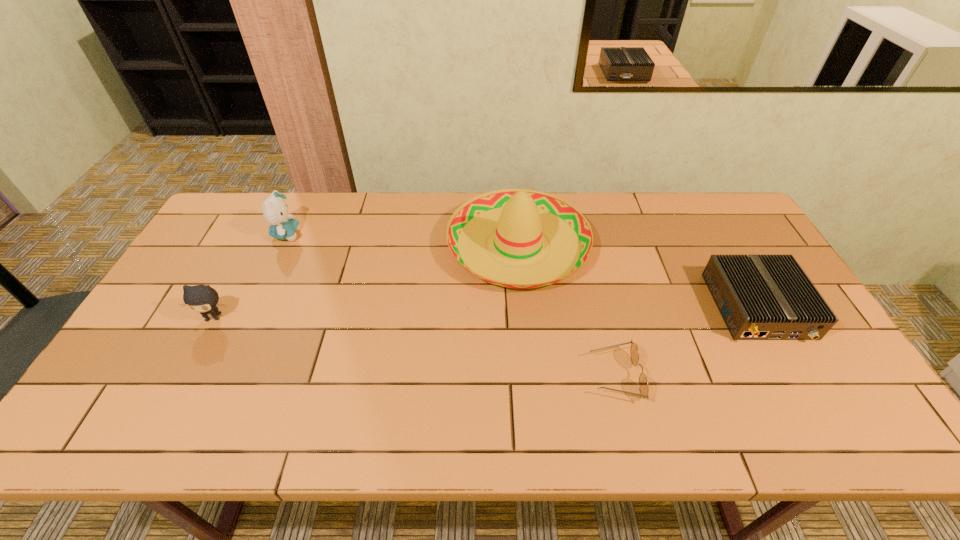
I want to click on sombrero, so click(520, 216).

Where is `the farther kitten`? the farther kitten is located at coordinates (275, 210).

Identify the location of the taller kitten. This screenshot has width=960, height=540. (275, 210).

The height and width of the screenshot is (540, 960). Identify the location of the nearer kitten. (201, 298).

You are a GUI agent. You are given a task and a screenshot of the screen. Output one action in this format:
    pyautogui.click(x=<x>, y=<y>)
    Task: Click on the shorter kitten
    The image size is (960, 540).
    Given the screenshot: What is the action you would take?
    pyautogui.click(x=201, y=298)

You are a GUI agent. You are given a task and a screenshot of the screen. Output one action in this format:
    pyautogui.click(x=<x>, y=<y>)
    Task: Click on the fourth tallest object
    The width and height of the screenshot is (960, 540).
    Given the screenshot: What is the action you would take?
    pyautogui.click(x=761, y=297)

You are a GUI agent. You are given a task and a screenshot of the screen. Output one action in this format:
    pyautogui.click(x=<x>, y=<y>)
    Task: Click on the router
    The width and height of the screenshot is (960, 540).
    Given the screenshot: What is the action you would take?
    pyautogui.click(x=761, y=297)

You are a GUI agent. You are given a task and a screenshot of the screen. Output one action in this format:
    pyautogui.click(x=<x>, y=<y>)
    Task: Click on the shortest object
    This screenshot has height=540, width=960.
    Given the screenshot: What is the action you would take?
    pyautogui.click(x=634, y=353)

Identify the location of the nearest object. The height and width of the screenshot is (540, 960). (634, 353).

You are a GUI agent. You are given a task and a screenshot of the screen. Output one action in this format:
    pyautogui.click(x=<x>, y=<y>)
    Task: Click on the free space located 0.380m on the right of the tallest object
    The image size is (960, 540).
    Given the screenshot: What is the action you would take?
    pyautogui.click(x=708, y=245)